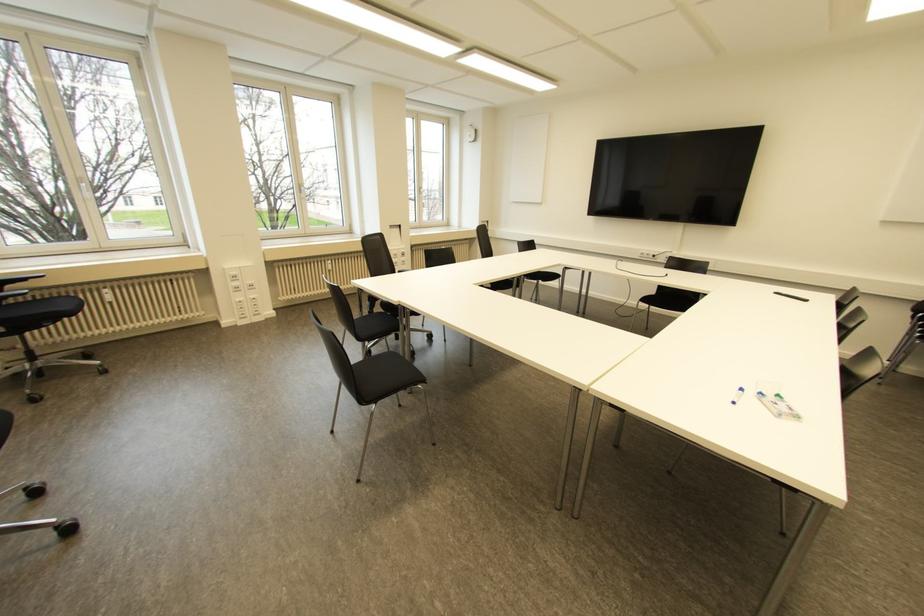
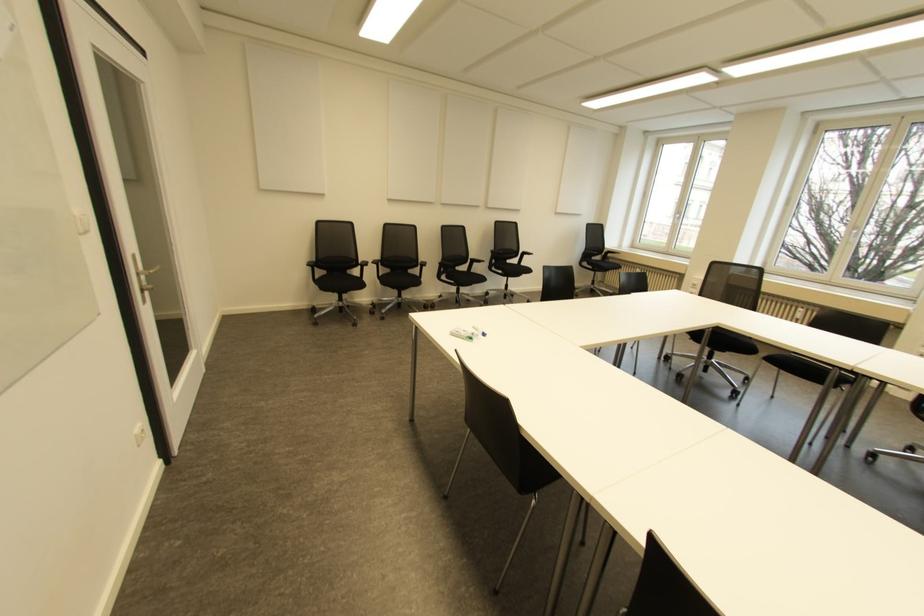
Question: I am providing you with two images of the same scene from different viewpoints. Which of the following objects are not visible in image2?

Choices:
 (A) black chair armrest
 (B) hanging paper towel
 (C) black chair sitting surface
 (D) board marker

Answer: (C)